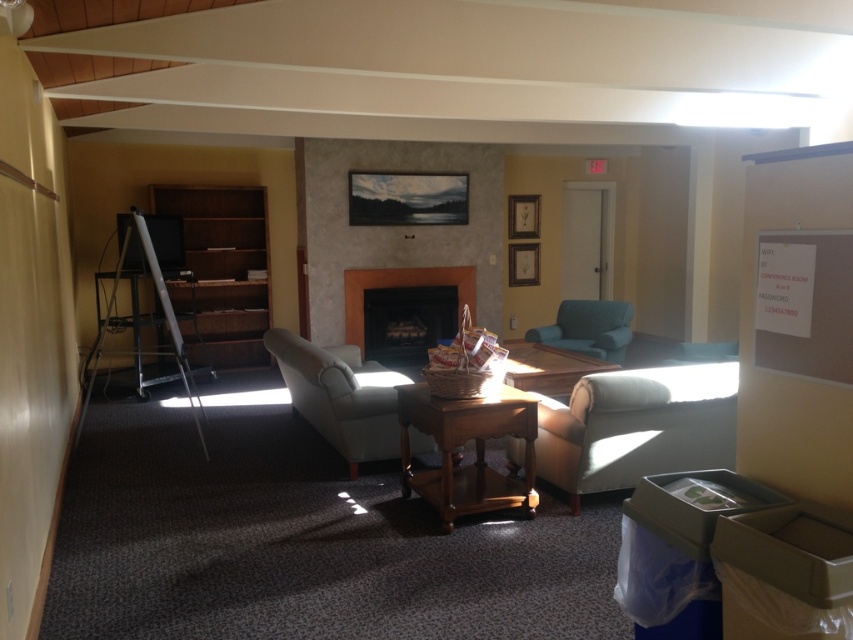
You are standing in the lounge and want to determine which of the two points, point (451, 276) or point (537, 349), is closer to you. Based on the scene description, which point is nearer?

Point (451, 276) is further to the viewer than point (537, 349). Wait, no, the description says the opposite. Let me check again. The Objects Description states that point (451, 276) is further to the viewer than point (537, 349). Therefore, the closer point would be (537, 349). Hmm, but the question asks which is nearer. Since point A is further away, point B must be closer. So the answer should be point (537, 349) is closer.

You are a delivery person who needs to place a tall package that is 1.8 meters in height. You see the wooden bookshelf at left and the teal fabric armchair at center. Which object can the package be placed next to without exceeding its height?

The wooden bookshelf at left has a greater height compared to the teal fabric armchair at center, so the tall package can be placed next to the wooden bookshelf at left as it is taller and can accommodate the package without exceeding its height.

You are sitting in the teal fabric armchair at center and want to grab a book from the wooden bookshelf at left. Can you reach the bookshelf without getting up?

The wooden bookshelf at left is above the teal fabric armchair at center, so you cannot reach it without getting up.